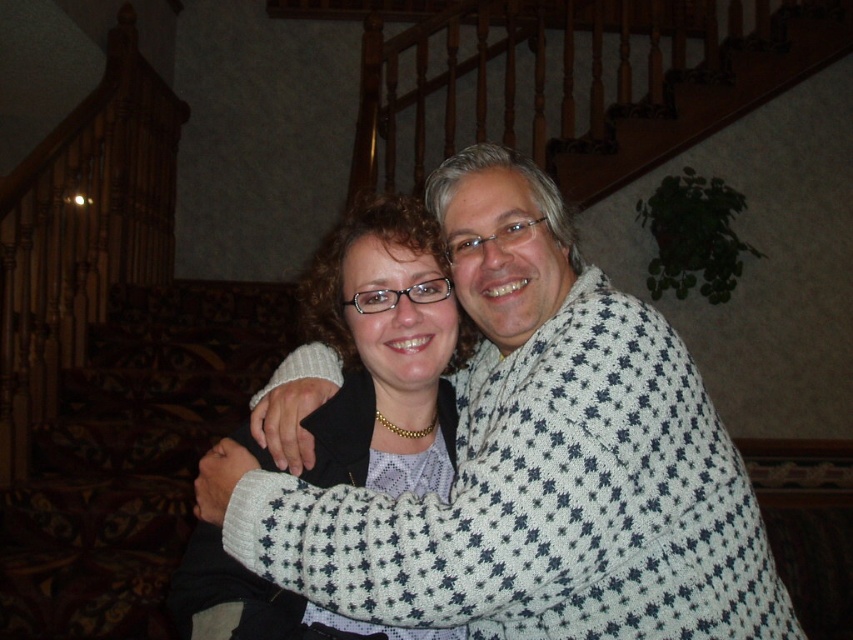
Between white dotted sweater at center and white knit sweater at center, which one is positioned lower?

white knit sweater at center is lower down.

Identify the location of white dotted sweater at center. (534, 461).

The height and width of the screenshot is (640, 853). What are the coordinates of `white dotted sweater at center` in the screenshot? It's located at (534, 461).